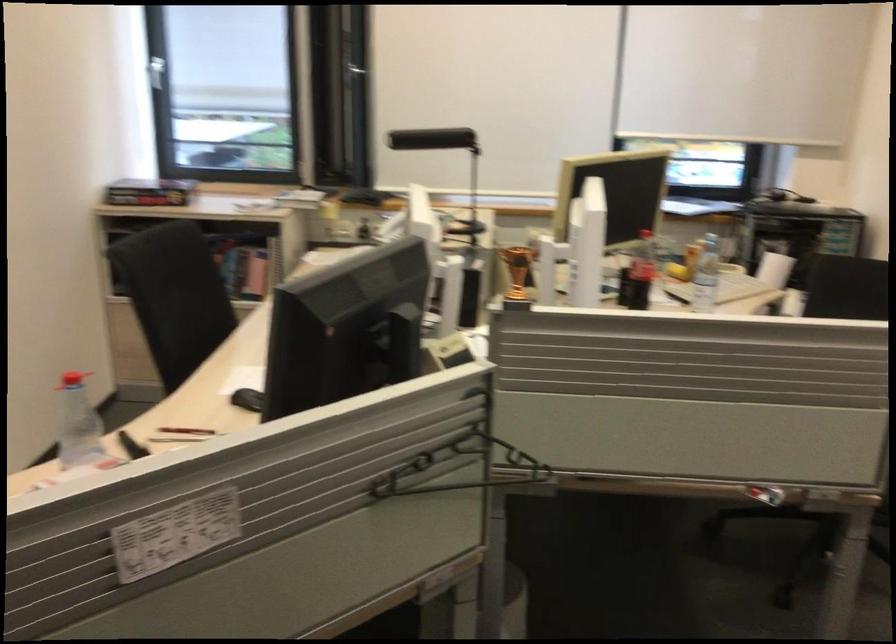
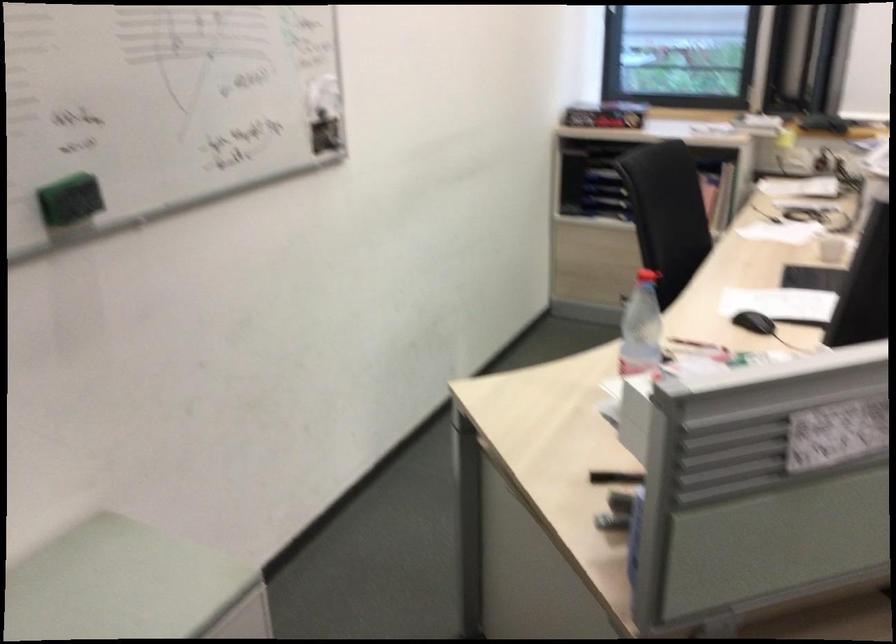
In the second image, find the point that corresponds to [82,431] in the first image.

(641, 327)